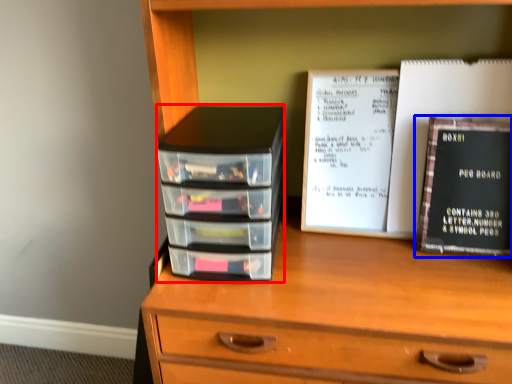
Question: Among these objects, which one is nearest to the camera, stack (highlighted by a red box) or book (highlighted by a blue box)?

Choices:
 (A) stack
 (B) book

Answer: (A)